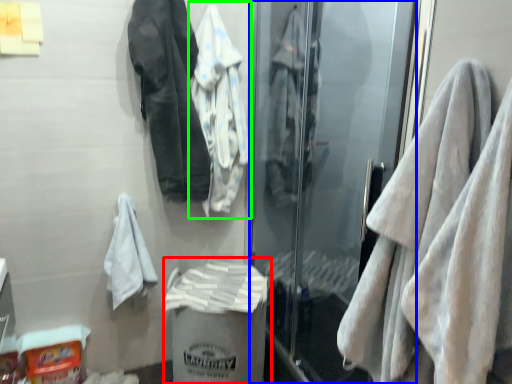
Question: Which object is the closest to the garbage (highlighted by a red box)? Choose among these: screen door (highlighted by a blue box) or jacket (highlighted by a green box).

Choices:
 (A) screen door
 (B) jacket

Answer: (A)